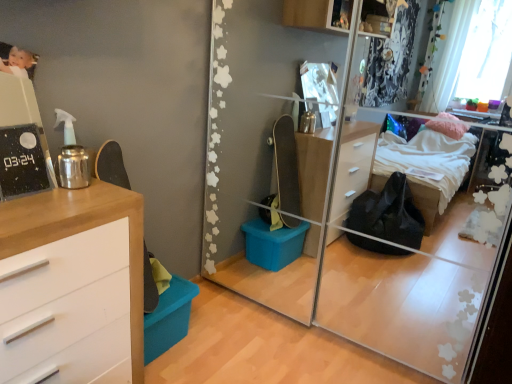
Question: Is wooden chest of drawers at left in front of or behind transparent glass mirror at center in the image?

Choices:
 (A) behind
 (B) front

Answer: (B)

Question: In terms of width, does wooden chest of drawers at left look wider or thinner when compared to transparent glass mirror at center?

Choices:
 (A) wide
 (B) thin

Answer: (B)

Question: From the image's perspective, is wooden chest of drawers at left positioned above or below transparent glass mirror at center?

Choices:
 (A) above
 (B) below

Answer: (B)

Question: Considering the positions of point (214, 46) and point (14, 354), is point (214, 46) closer or farther from the camera than point (14, 354)?

Choices:
 (A) closer
 (B) farther

Answer: (B)

Question: Considering the positions of transparent glass mirror at center and wooden chest of drawers at left in the image, is transparent glass mirror at center bigger or smaller than wooden chest of drawers at left?

Choices:
 (A) small
 (B) big

Answer: (B)

Question: Relative to wooden chest of drawers at left, is transparent glass mirror at center in front or behind?

Choices:
 (A) behind
 (B) front

Answer: (A)

Question: From the image's perspective, relative to wooden chest of drawers at left, is transparent glass mirror at center above or below?

Choices:
 (A) above
 (B) below

Answer: (A)